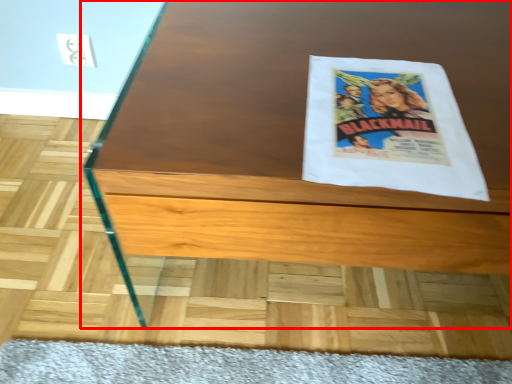
Question: Observing the image, what is the correct spatial positioning of table (annotated by the red box) in reference to flyer?

Choices:
 (A) right
 (B) left

Answer: (A)